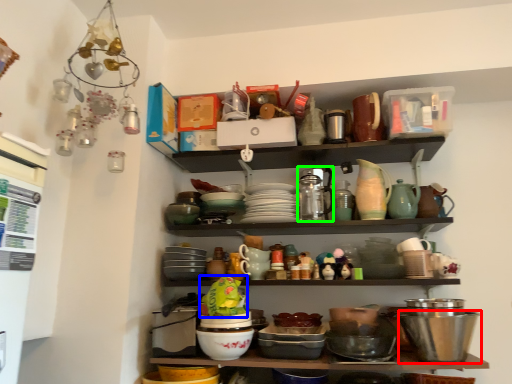
Question: Estimate the real-world distances between objects in this image. Which object is closer to bowl (highlighted by a red box), food (highlighted by a blue box) or tableware (highlighted by a green box)?

Choices:
 (A) food
 (B) tableware

Answer: (B)